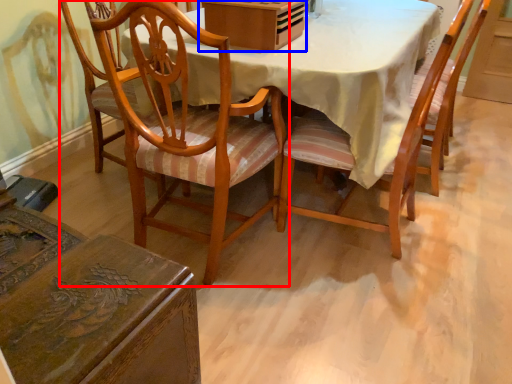
Question: Which of the following is the farthest to the observer, chair (highlighted by a red box) or box (highlighted by a blue box)?

Choices:
 (A) chair
 (B) box

Answer: (B)